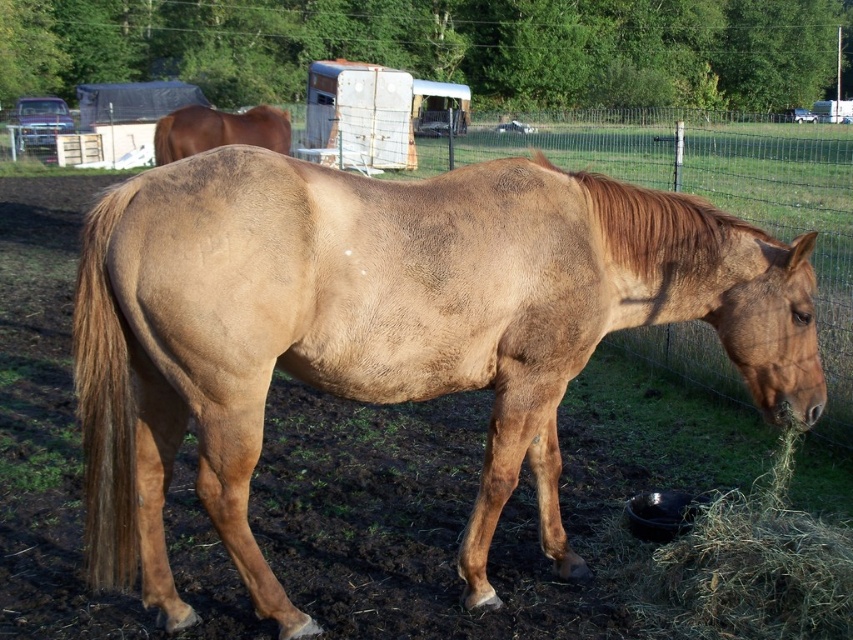
Can you confirm if green straw at lower right is positioned to the right of brown matte horse at upper left?

Correct, you'll find green straw at lower right to the right of brown matte horse at upper left.

Based on the photo, between green straw at lower right and brown matte horse at upper left, which one has more height?

Standing taller between the two is brown matte horse at upper left.

Which is in front, point (734, 593) or point (251, 140)?

Point (734, 593) is in front.

Locate an element on the screen. green straw at lower right is located at coordinates (750, 557).

Measure the distance between brown matte horse at center and green straw at lower right.

34.90 inches

Between point (485, 525) and point (782, 440), which one is positioned in front?

Point (485, 525) is in front.

Locate an element on the screen. brown matte horse at center is located at coordinates (387, 328).

Is brown matte horse at center to the right of brown matte horse at upper left from the viewer's perspective?

Yes, brown matte horse at center is to the right of brown matte horse at upper left.

Describe the element at coordinates (387, 328) in the screenshot. I see `brown matte horse at center` at that location.

Which is behind, point (471, 600) or point (213, 124)?

Point (213, 124)

You are a GUI agent. You are given a task and a screenshot of the screen. Output one action in this format:
    pyautogui.click(x=<x>, y=<y>)
    Task: Click on the brown matte horse at center
    This screenshot has height=640, width=853.
    Given the screenshot: What is the action you would take?
    pyautogui.click(x=387, y=328)